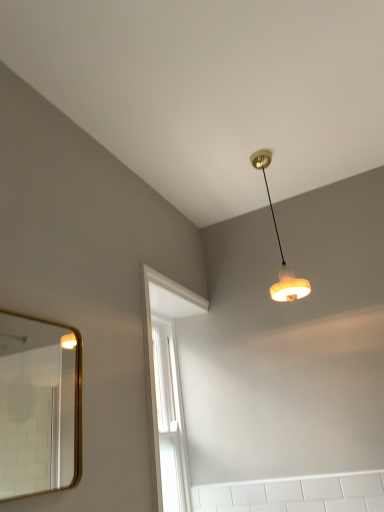
What do you see at coordinates (39, 406) in the screenshot?
I see `gold-framed mirror at left` at bounding box center [39, 406].

In order to face gold-framed mirror at left, should I rotate leftwards or rightwards?

Rotate your view left by about 18.988°.

I want to click on gold-framed mirror at left, so click(39, 406).

What is the approximate height of gold-framed mirror at left?

The height of gold-framed mirror at left is 20.83 inches.

What do you see at coordinates (280, 246) in the screenshot?
I see `matte orange lampshade at upper center` at bounding box center [280, 246].

Find the location of `matte orange lampshade at upper center`. matte orange lampshade at upper center is located at coordinates (280, 246).

Where is `gold-framed mirror at left`? Image resolution: width=384 pixels, height=512 pixels. gold-framed mirror at left is located at coordinates (39, 406).

Is gold-framed mirror at left at the left side of matte orange lampshade at upper center?

Indeed, gold-framed mirror at left is positioned on the left side of matte orange lampshade at upper center.

Looking at this image, does gold-framed mirror at left come in front of matte orange lampshade at upper center?

Yes, it is in front of matte orange lampshade at upper center.

Which is less distant, [59,335] or [286,281]?

Clearly, point [59,335] is more distant from the camera than point [286,281].

From the image's perspective, which one is positioned lower, gold-framed mirror at left or matte orange lampshade at upper center?

gold-framed mirror at left, from the image's perspective.

From a real-world perspective, relative to matte orange lampshade at upper center, is gold-framed mirror at left vertically above or below?

In terms of real-world spatial position, gold-framed mirror at left is below matte orange lampshade at upper center.

Which of these two, gold-framed mirror at left or matte orange lampshade at upper center, is thinner?

gold-framed mirror at left is thinner.

Can you confirm if gold-framed mirror at left is shorter than matte orange lampshade at upper center?

Indeed, gold-framed mirror at left has a lesser height compared to matte orange lampshade at upper center.

Looking at the image, does gold-framed mirror at left seem bigger or smaller compared to matte orange lampshade at upper center?

gold-framed mirror at left is smaller than matte orange lampshade at upper center.

Is gold-framed mirror at left inside or outside of matte orange lampshade at upper center?

gold-framed mirror at left is not inside matte orange lampshade at upper center, it's outside.

Are gold-framed mirror at left and matte orange lampshade at upper center far apart?

Yes, gold-framed mirror at left is far from matte orange lampshade at upper center.

Is gold-framed mirror at left looking in the opposite direction of matte orange lampshade at upper center?

No, gold-framed mirror at left is not facing away from matte orange lampshade at upper center.

Can you tell me how much gold-framed mirror at left and matte orange lampshade at upper center differ in facing direction?

The angular difference between gold-framed mirror at left and matte orange lampshade at upper center is 90.1 degrees.

Where is `lamp that appears behind the gold-framed mirror at left`? The width and height of the screenshot is (384, 512). lamp that appears behind the gold-framed mirror at left is located at coordinates (280, 246).

Considering the positions of objects matte orange lampshade at upper center and gold-framed mirror at left in the image provided, who is more to the right, matte orange lampshade at upper center or gold-framed mirror at left?

matte orange lampshade at upper center.

Relative to gold-framed mirror at left, is matte orange lampshade at upper center in front or behind?

Visually, matte orange lampshade at upper center is located behind gold-framed mirror at left.

Considering the points (278, 298) and (0, 339), which point is in front, point (278, 298) or point (0, 339)?

Positioned in front is point (278, 298).

From the image's perspective, does matte orange lampshade at upper center appear higher than gold-framed mirror at left?

Yes, from the image's perspective, matte orange lampshade at upper center is over gold-framed mirror at left.

Based on the photo, from a real-world perspective, between matte orange lampshade at upper center and gold-framed mirror at left, who is vertically higher?

In real-world perspective, matte orange lampshade at upper center is above.

Which of these two, matte orange lampshade at upper center or gold-framed mirror at left, is thinner?

gold-framed mirror at left.

In terms of height, does matte orange lampshade at upper center look taller or shorter compared to gold-framed mirror at left?

Clearly, matte orange lampshade at upper center is taller compared to gold-framed mirror at left.

Between matte orange lampshade at upper center and gold-framed mirror at left, which one has larger size?

With larger size is matte orange lampshade at upper center.

Is matte orange lampshade at upper center outside of gold-framed mirror at left?

Yes.

Is the surface of matte orange lampshade at upper center in direct contact with gold-framed mirror at left?

No, matte orange lampshade at upper center is not beside gold-framed mirror at left.

Looking at this image, is matte orange lampshade at upper center aimed at gold-framed mirror at left?

No, matte orange lampshade at upper center is not turned towards gold-framed mirror at left.

The image size is (384, 512). Find the location of `mirror in front of the matte orange lampshade at upper center`. mirror in front of the matte orange lampshade at upper center is located at coordinates (39, 406).

Where is `mirror beneath the matte orange lampshade at upper center (from a real-world perspective)`? Image resolution: width=384 pixels, height=512 pixels. mirror beneath the matte orange lampshade at upper center (from a real-world perspective) is located at coordinates (39, 406).

This screenshot has height=512, width=384. What are the coordinates of `lamp that appears on the right of gold-framed mirror at left` in the screenshot? It's located at (280, 246).